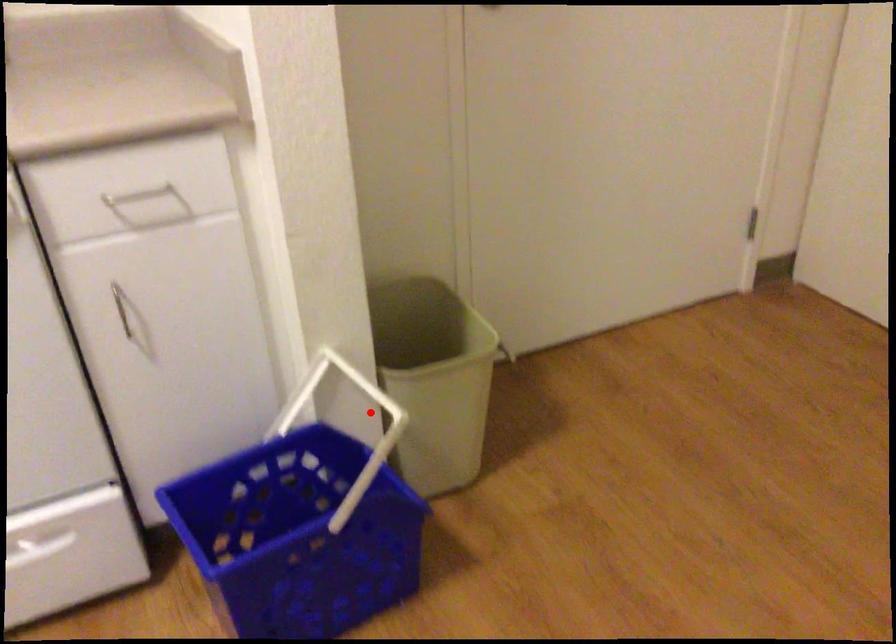
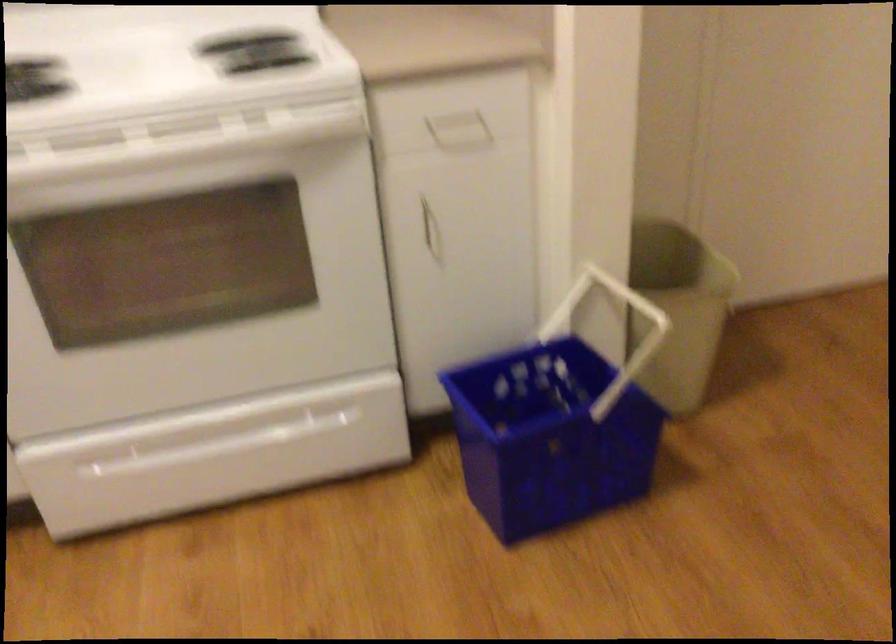
The point at the highlighted location is marked in the first image. Where is the corresponding point in the second image?

(616, 330)